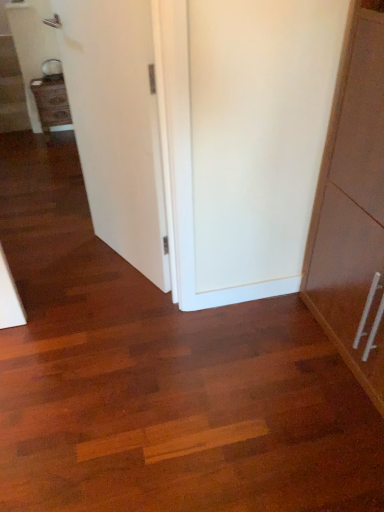
Where is `free space on the front side of matte wood cabinet at left`? The width and height of the screenshot is (384, 512). free space on the front side of matte wood cabinet at left is located at coordinates (50, 148).